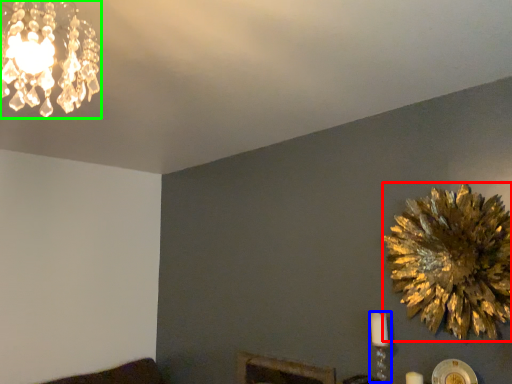
Question: Which is nearer to the flower (highlighted by a red box)? candle holder (highlighted by a blue box) or lamp (highlighted by a green box).

Choices:
 (A) candle holder
 (B) lamp

Answer: (A)